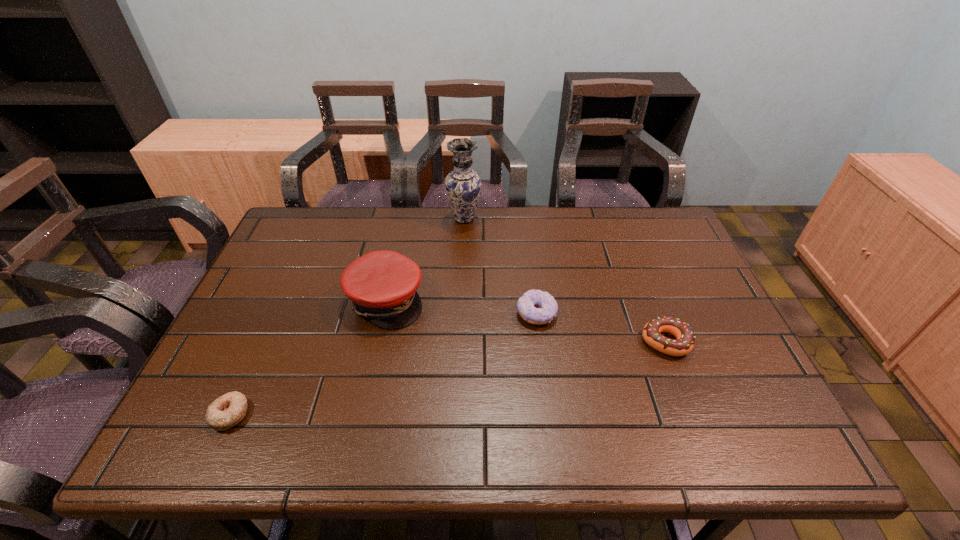
The image size is (960, 540). I want to click on free location located on the right of the rightmost object, so click(x=721, y=342).

Image resolution: width=960 pixels, height=540 pixels. I want to click on free space located on the right of the second object from right to left, so click(652, 313).

What are the coordinates of `vacant space located on the right of the shortest object` in the screenshot? It's located at (425, 414).

This screenshot has width=960, height=540. Identify the location of object located in the far edge section of the desktop. tap(463, 185).

Locate an element on the screen. object present at the near edge is located at coordinates coord(228,410).

Where is `object that is at the left edge`? Image resolution: width=960 pixels, height=540 pixels. object that is at the left edge is located at coordinates (228, 410).

I want to click on object positioned at the right edge, so click(x=683, y=344).

The height and width of the screenshot is (540, 960). I want to click on object situated at the near left corner, so click(x=228, y=410).

Identify the location of free space at the far edge of the desktop. (x=385, y=240).

Identify the location of free region at the near edge of the desktop. (433, 430).